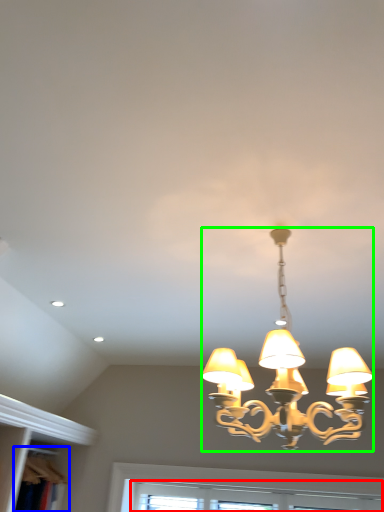
Question: Which is nearer to the window (highlighted by a red box)? bookshelf (highlighted by a blue box) or lamp (highlighted by a green box).

Choices:
 (A) bookshelf
 (B) lamp

Answer: (B)